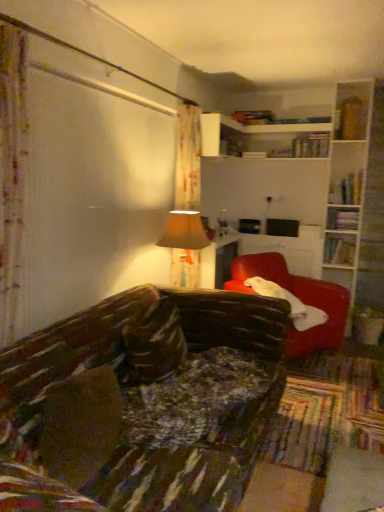
Describe the element at coordinates (184, 246) in the screenshot. I see `beige fabric lampshade at center` at that location.

Where is `matte red armchair at right`? The width and height of the screenshot is (384, 512). matte red armchair at right is located at coordinates (299, 298).

In order to face matte red armchair at right, should I rotate leftwards or rightwards?

You should rotate right by 12.299 degrees.

Locate an element on the screen. The width and height of the screenshot is (384, 512). hardcover book at upper center, the fourth book in the bottom-to-top sequence is located at coordinates (254, 117).

The height and width of the screenshot is (512, 384). Describe the element at coordinates (339, 251) in the screenshot. I see `hardcover book at upper right, which is counted as the second book, starting from the right` at that location.

In order to click on hardcover books at upper right, acting as the 2th book starting from the top in this screenshot , I will do `click(347, 190)`.

Find the location of a particular element. The width and height of the screenshot is (384, 512). hardcover book at upper right, the 3th book in the right-to-left sequence is located at coordinates (342, 218).

Identify the location of table lamp that is on the left side of hardcover book at upper right, which appears as the second book when viewed from the left. (184, 246).

Is beige fabric lampshade at center bigger than hardcover book at upper right, the 3th book in the right-to-left sequence?

Yes.

In the scene shown: From a real-world perspective, which is physically above, beige fabric lampshade at center or hardcover book at upper right, the 2th book positioned from the bottom?

In real-world perspective, hardcover book at upper right, the 2th book positioned from the bottom, is above.

Is beige fabric lampshade at center taller or shorter than hardcover book at upper right, the 2th book positioned from the bottom?

In the image, beige fabric lampshade at center appears to be taller than hardcover book at upper right, the 2th book positioned from the bottom.

Is hardcover book at upper center, acting as the fourth book starting from the right, far from hardcover books at upper right, arranged as the third book when ordered from the bottom?

Yes, hardcover book at upper center, acting as the fourth book starting from the right, is far from hardcover books at upper right, arranged as the third book when ordered from the bottom.

Is hardcover book at upper center, the 1th book when ordered from top to bottom, at the right side of hardcover books at upper right, which ranks as the 4th book in left-to-right order?

No, hardcover book at upper center, the 1th book when ordered from top to bottom, is not to the right of hardcover books at upper right, which ranks as the 4th book in left-to-right order.

Would you say hardcover book at upper center, the fourth book in the bottom-to-top sequence, is outside hardcover books at upper right, which ranks as the 4th book in left-to-right order?

Yes, hardcover book at upper center, the fourth book in the bottom-to-top sequence, is located beyond the bounds of hardcover books at upper right, which ranks as the 4th book in left-to-right order.

From the image's perspective, is hardcover book at upper center, the 1th book when ordered from top to bottom, located above or below hardcover books at upper right, which ranks as the 4th book in left-to-right order?

Based on their image positions, hardcover book at upper center, the 1th book when ordered from top to bottom, is located above hardcover books at upper right, which ranks as the 4th book in left-to-right order.

Find the location of a particular element. The height and width of the screenshot is (512, 384). the 1st book located above the hardcover book at upper right, the fourth book viewed from the top (from a real-world perspective) is located at coordinates (342, 218).

Are hardcover book at upper right, which appears as the second book when viewed from the left, and hardcover book at upper right, which is counted as the second book, starting from the right, beside each other?

No, hardcover book at upper right, which appears as the second book when viewed from the left, is not making contact with hardcover book at upper right, which is counted as the second book, starting from the right.

Is point (332, 222) positioned in front of point (350, 257)?

No, it is behind (350, 257).

Considering the relative positions of hardcover book at upper right, the 3th book in the right-to-left sequence, and hardcover book at upper right, which ranks as the third book in left-to-right order, in the image provided, is hardcover book at upper right, the 3th book in the right-to-left sequence, to the right of hardcover book at upper right, which ranks as the third book in left-to-right order, from the viewer's perspective?

Incorrect, hardcover book at upper right, the 3th book in the right-to-left sequence, is not on the right side of hardcover book at upper right, which ranks as the third book in left-to-right order.

Is hardcover book at upper right, the first book positioned from the bottom, taller or shorter than hardcover books at upper right, positioned as the 1th book in right-to-left order?

Clearly, hardcover book at upper right, the first book positioned from the bottom, is shorter compared to hardcover books at upper right, positioned as the 1th book in right-to-left order.

Is hardcover book at upper right, which ranks as the third book in left-to-right order, located outside hardcover books at upper right, which ranks as the 4th book in left-to-right order?

hardcover book at upper right, which ranks as the third book in left-to-right order, is positioned outside hardcover books at upper right, which ranks as the 4th book in left-to-right order.

From a real-world perspective, is hardcover book at upper right, which ranks as the third book in left-to-right order, physically above hardcover books at upper right, acting as the 2th book starting from the top?

Actually, hardcover book at upper right, which ranks as the third book in left-to-right order, is physically below hardcover books at upper right, acting as the 2th book starting from the top, in the real world.

Which object is positioned more to the left, hardcover book at upper right, which is counted as the second book, starting from the right, or hardcover books at upper right, positioned as the 1th book in right-to-left order?

From the viewer's perspective, hardcover book at upper right, which is counted as the second book, starting from the right, appears more on the left side.

Are hardcover book at upper center, the fourth book in the bottom-to-top sequence, and hardcover book at upper right, the fourth book viewed from the top, far apart?

Yes, hardcover book at upper center, the fourth book in the bottom-to-top sequence, and hardcover book at upper right, the fourth book viewed from the top, are quite far apart.

Which of these two, hardcover book at upper center, which is counted as the first book, starting from the left, or hardcover book at upper right, which ranks as the third book in left-to-right order, is wider?

Wider between the two is hardcover book at upper center, which is counted as the first book, starting from the left.

Measure the distance from hardcover book at upper center, which is counted as the first book, starting from the left, to hardcover book at upper right, the first book positioned from the bottom.

hardcover book at upper center, which is counted as the first book, starting from the left, is 1.45 meters away from hardcover book at upper right, the first book positioned from the bottom.

Does hardcover book at upper center, which is counted as the first book, starting from the left, have a greater height compared to hardcover book at upper right, which ranks as the third book in left-to-right order?

No.

Would you say matte red armchair at right is a long distance from beige fabric lampshade at center?

No, matte red armchair at right is not far away from beige fabric lampshade at center.

How different are the orientations of matte red armchair at right and beige fabric lampshade at center in degrees?

35.8 degrees separate the facing orientations of matte red armchair at right and beige fabric lampshade at center.

Between matte red armchair at right and beige fabric lampshade at center, which one has larger width?

matte red armchair at right.

Is matte red armchair at right inside or outside of beige fabric lampshade at center?

matte red armchair at right is not enclosed by beige fabric lampshade at center.

Looking at this image, is hardcover book at upper right, the first book positioned from the bottom, smaller than hardcover book at upper center, acting as the fourth book starting from the right?

Yes, hardcover book at upper right, the first book positioned from the bottom, is smaller than hardcover book at upper center, acting as the fourth book starting from the right.

Does point (338, 239) appear closer or farther from the camera than point (251, 120)?

Point (338, 239) appears to be farther away from the viewer than point (251, 120).

Which object is closer to the camera taking this photo, hardcover book at upper right, which ranks as the third book in left-to-right order, or hardcover book at upper center, the 1th book when ordered from top to bottom?

hardcover book at upper center, the 1th book when ordered from top to bottom.

At what (x,y) coordinates should I click in order to perform the action: click on book that is the 2nd one when counting upward from the beige fabric lampshade at center (from the image's perspective). Please return your answer as a coordinate pair (x, y). The image size is (384, 512). Looking at the image, I should click on (342, 218).

At what (x,y) coordinates should I click in order to perform the action: click on the 2nd book behind the hardcover books at upper right, which ranks as the 4th book in left-to-right order. Please return your answer as a coordinate pair (x, y). This screenshot has width=384, height=512. Looking at the image, I should click on (254, 117).

From the picture: Which object lies nearer to the anchor point matte red armchair at right, hardcover book at upper right, which is counted as the second book, starting from the right, or hardcover books at upper right, acting as the 2th book starting from the top?

Among the two, hardcover book at upper right, which is counted as the second book, starting from the right, is located nearer to matte red armchair at right.

When comparing their distances from matte red armchair at right, does hardcover books at upper right, positioned as the 1th book in right-to-left order, or beige fabric lampshade at center seem further?

hardcover books at upper right, positioned as the 1th book in right-to-left order, is further to matte red armchair at right.

When comparing their distances from matte red armchair at right, does hardcover book at upper right, which appears as the second book when viewed from the left, or hardcover book at upper center, the fourth book in the bottom-to-top sequence, seem closer?

hardcover book at upper right, which appears as the second book when viewed from the left, is positioned closer to the anchor matte red armchair at right.

When comparing their distances from beige fabric lampshade at center, does hardcover book at upper right, the 2th book positioned from the bottom, or hardcover books at upper right, which ranks as the 4th book in left-to-right order, seem closer?

hardcover book at upper right, the 2th book positioned from the bottom.

Considering their positions, is hardcover book at upper center, which is counted as the first book, starting from the left, positioned further to beige fabric lampshade at center than hardcover books at upper right, which ranks as the 4th book in left-to-right order?

Based on the image, hardcover books at upper right, which ranks as the 4th book in left-to-right order, appears to be further to beige fabric lampshade at center.

Based on their spatial positions, is beige fabric lampshade at center or hardcover book at upper right, the first book positioned from the bottom, further from hardcover book at upper center, which is counted as the first book, starting from the left?

beige fabric lampshade at center is further to hardcover book at upper center, which is counted as the first book, starting from the left.

Consider the image. Considering their positions, is hardcover book at upper right, the fourth book viewed from the top, positioned closer to matte red armchair at right than hardcover book at upper right, the 3th book in the right-to-left sequence?

hardcover book at upper right, the fourth book viewed from the top, is closer to matte red armchair at right.

Considering their positions, is hardcover book at upper center, the fourth book in the bottom-to-top sequence, positioned closer to hardcover book at upper right, which is counted as the second book, starting from the right, than matte red armchair at right?

The object closer to hardcover book at upper right, which is counted as the second book, starting from the right, is matte red armchair at right.

The image size is (384, 512). Identify the location of book between hardcover book at upper center, the 1th book when ordered from top to bottom, and hardcover book at upper right, the 3th book in the right-to-left sequence, vertically. (347, 190).

Locate an element on the screen. table lamp that lies between hardcover book at upper center, acting as the fourth book starting from the right, and matte red armchair at right from top to bottom is located at coordinates (184, 246).

Locate an element on the screen. chair situated between beige fabric lampshade at center and hardcover book at upper right, which ranks as the third book in left-to-right order, from left to right is located at coordinates (299, 298).

In order to click on book between hardcover books at upper right, arranged as the third book when ordered from the bottom, and hardcover book at upper right, the fourth book viewed from the top, in the vertical direction in this screenshot , I will do `click(342, 218)`.